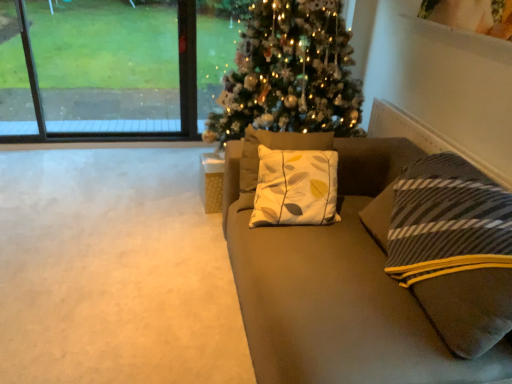
What is the approximate height of suede couch at center?

suede couch at center is 29.50 inches tall.

Locate an element on the screen. The width and height of the screenshot is (512, 384). iridescent glass christmas tree at center is located at coordinates (290, 74).

Where is `transparent glass window at upper left`? The width and height of the screenshot is (512, 384). transparent glass window at upper left is located at coordinates (112, 68).

Where is `wooden cube at center`? The width and height of the screenshot is (512, 384). wooden cube at center is located at coordinates (211, 182).

Is point (118, 4) in front of point (341, 77)?

That is False.

How much distance is there between transparent glass window at upper left and iridescent glass christmas tree at center?

transparent glass window at upper left and iridescent glass christmas tree at center are 3.83 feet apart.

Which object is positioned more to the left, transparent glass window at upper left or iridescent glass christmas tree at center?

transparent glass window at upper left is more to the left.

Does transparent glass window at upper left have a smaller size compared to iridescent glass christmas tree at center?

Yes, transparent glass window at upper left is smaller than iridescent glass christmas tree at center.

Is suede couch at center aimed at iridescent glass christmas tree at center?

No, suede couch at center is not oriented towards iridescent glass christmas tree at center.

Are suede couch at center and iridescent glass christmas tree at center making contact?

No, suede couch at center is not with iridescent glass christmas tree at center.

This screenshot has height=384, width=512. I want to click on studio couch that appears in front of the iridescent glass christmas tree at center, so click(332, 304).

In the scene shown: Between suede couch at center and iridescent glass christmas tree at center, which one appears on the right side from the viewer's perspective?

Positioned to the right is suede couch at center.

Considering the sizes of objects iridescent glass christmas tree at center and suede couch at center in the image provided, who is bigger, iridescent glass christmas tree at center or suede couch at center?

Bigger between the two is iridescent glass christmas tree at center.

Can you confirm if iridescent glass christmas tree at center is taller than suede couch at center?

Yes, iridescent glass christmas tree at center is taller than suede couch at center.

From a real-world perspective, which is physically below, iridescent glass christmas tree at center or suede couch at center?

In real-world perspective, suede couch at center is lower.

Is the position of wooden cube at center more distant than that of suede couch at center?

Yes.

Is wooden cube at center with suede couch at center?

No.

How many degrees apart are the facing directions of wooden cube at center and suede couch at center?

They differ by 3.62 degrees in their facing directions.

From a real-world perspective, between wooden cube at center and iridescent glass christmas tree at center, who is vertically lower?

wooden cube at center.

Does wooden cube at center turn towards iridescent glass christmas tree at center?

Yes, wooden cube at center is facing iridescent glass christmas tree at center.

Is wooden cube at center far from iridescent glass christmas tree at center?

No.

Is wooden cube at center positioned beyond the bounds of iridescent glass christmas tree at center?

No, wooden cube at center is inside or overlapping with iridescent glass christmas tree at center.

Is iridescent glass christmas tree at center positioned behind wooden cube at center?

No.

Is iridescent glass christmas tree at center aimed at wooden cube at center?

Yes, iridescent glass christmas tree at center is aimed at wooden cube at center.

Find the location of a particular element. christmas tree on the right side of wooden cube at center is located at coordinates (290, 74).

Which is behind, point (320, 126) or point (209, 170)?

The point (209, 170) is more distant.

From a real-world perspective, which object rests below the other?

wooden cube at center.

Could you tell me if transparent glass window at upper left is facing wooden cube at center?

Yes, transparent glass window at upper left is aimed at wooden cube at center.

In the scene shown: Considering the sizes of objects transparent glass window at upper left and wooden cube at center in the image provided, who is thinner, transparent glass window at upper left or wooden cube at center?

transparent glass window at upper left is thinner.

Is transparent glass window at upper left taller than wooden cube at center?

Result: Yes.

Locate an element on the screen. christmas tree that appears on the right of transparent glass window at upper left is located at coordinates (290, 74).

Where is `studio couch below the iridescent glass christmas tree at center (from a real-world perspective)`? studio couch below the iridescent glass christmas tree at center (from a real-world perspective) is located at coordinates (332, 304).

From the image, which object appears to be farther from suede couch at center, transparent glass window at upper left or wooden cube at center?

Based on the image, transparent glass window at upper left appears to be further to suede couch at center.

Looking at the image, which one is located closer to suede couch at center, wooden cube at center or transparent glass window at upper left?

wooden cube at center lies closer to suede couch at center than the other object.

Which object lies nearer to the anchor point transparent glass window at upper left, iridescent glass christmas tree at center or wooden cube at center?

Among the two, iridescent glass christmas tree at center is located nearer to transparent glass window at upper left.

Looking at the image, which one is located closer to transparent glass window at upper left, suede couch at center or wooden cube at center?

Among the two, wooden cube at center is located nearer to transparent glass window at upper left.

From the picture: Looking at the image, which one is located further to wooden cube at center, transparent glass window at upper left or suede couch at center?

The object further to wooden cube at center is transparent glass window at upper left.

From the image, which object appears to be nearer to wooden cube at center, suede couch at center or iridescent glass christmas tree at center?

iridescent glass christmas tree at center is closer to wooden cube at center.

Which object lies further to the anchor point iridescent glass christmas tree at center, wooden cube at center or suede couch at center?

Among the two, suede couch at center is located further to iridescent glass christmas tree at center.

Based on their spatial positions, is transparent glass window at upper left or iridescent glass christmas tree at center further from wooden cube at center?

transparent glass window at upper left lies further to wooden cube at center than the other object.

This screenshot has width=512, height=384. I want to click on christmas tree that lies between transparent glass window at upper left and wooden cube at center from top to bottom, so click(x=290, y=74).

Locate an element on the screen. furniture between suede couch at center and transparent glass window at upper left from front to back is located at coordinates (211, 182).

I want to click on christmas tree between suede couch at center and wooden cube at center from front to back, so click(290, 74).

The width and height of the screenshot is (512, 384). In order to click on christmas tree positioned between suede couch at center and transparent glass window at upper left from near to far in this screenshot , I will do `click(290, 74)`.